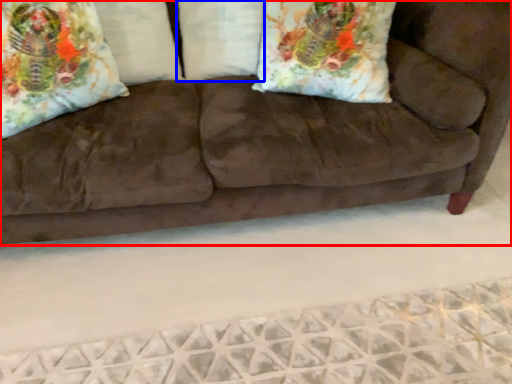
Question: Which object appears closest to the camera in this image, studio couch (highlighted by a red box) or pillow (highlighted by a blue box)?

Choices:
 (A) studio couch
 (B) pillow

Answer: (A)